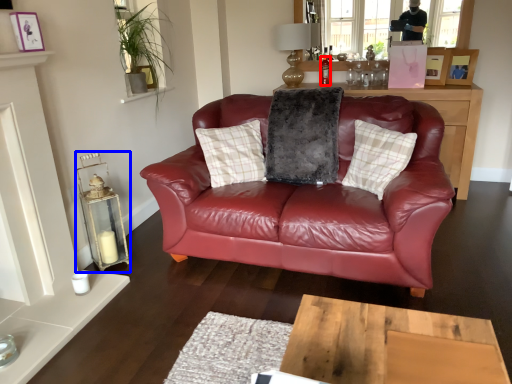
Question: Which of the following is the closest to the observer, bottle (highlighted by a red box) or candle holder (highlighted by a blue box)?

Choices:
 (A) bottle
 (B) candle holder

Answer: (B)